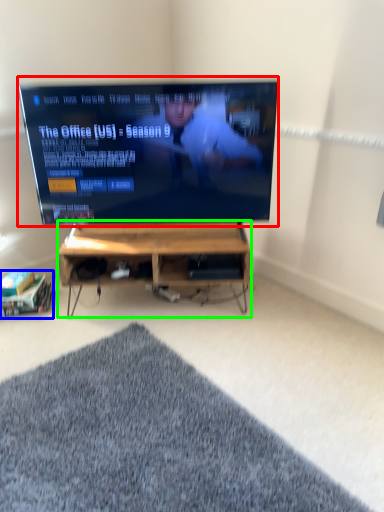
Question: Estimate the real-world distances between objects in this image. Which object is farther from television (highlighted by a red box), shelf (highlighted by a blue box) or desk (highlighted by a green box)?

Choices:
 (A) shelf
 (B) desk

Answer: (A)